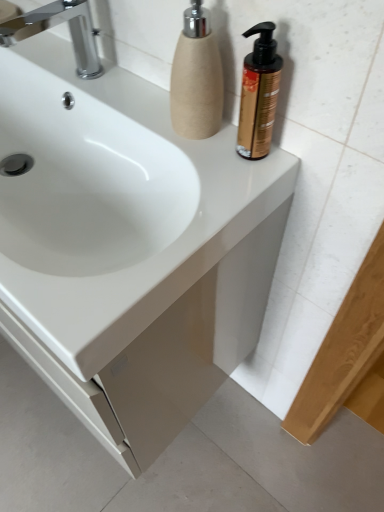
Question: From a real-world perspective, is chrome metallic faucet at upper left on top of beige textured soap dispenser at upper right, marked as the 2th soap dispenser in a right-to-left arrangement?

Choices:
 (A) no
 (B) yes

Answer: (A)

Question: From the image's perspective, is chrome metallic faucet at upper left above beige textured soap dispenser at upper right, which is the first soap dispenser in left-to-right order?

Choices:
 (A) yes
 (B) no

Answer: (A)

Question: Is there a large distance between chrome metallic faucet at upper left and beige textured soap dispenser at upper right, marked as the 2th soap dispenser in a right-to-left arrangement?

Choices:
 (A) no
 (B) yes

Answer: (A)

Question: Does chrome metallic faucet at upper left appear on the right side of beige textured soap dispenser at upper right, marked as the 2th soap dispenser in a right-to-left arrangement?

Choices:
 (A) no
 (B) yes

Answer: (A)

Question: Considering the relative sizes of chrome metallic faucet at upper left and beige textured soap dispenser at upper right, which is the first soap dispenser in left-to-right order, in the image provided, is chrome metallic faucet at upper left wider than beige textured soap dispenser at upper right, which is the first soap dispenser in left-to-right order,?

Choices:
 (A) yes
 (B) no

Answer: (A)

Question: From the image's perspective, relative to white glossy sink at center, is chrome metallic faucet at upper left above or below?

Choices:
 (A) above
 (B) below

Answer: (A)

Question: In the image, is chrome metallic faucet at upper left positioned in front of or behind white glossy sink at center?

Choices:
 (A) behind
 (B) front

Answer: (A)

Question: Is chrome metallic faucet at upper left inside the boundaries of white glossy sink at center, or outside?

Choices:
 (A) inside
 (B) outside

Answer: (B)

Question: Considering the positions of point (84, 45) and point (155, 230), is point (84, 45) closer or farther from the camera than point (155, 230)?

Choices:
 (A) closer
 (B) farther

Answer: (B)

Question: Do you think white glossy sink at center is within beige textured soap dispenser at upper right, which is the first soap dispenser in left-to-right order, or outside of it?

Choices:
 (A) inside
 (B) outside

Answer: (B)

Question: From a real-world perspective, is white glossy sink at center above or below beige textured soap dispenser at upper right, marked as the 2th soap dispenser in a right-to-left arrangement?

Choices:
 (A) below
 (B) above

Answer: (A)

Question: Based on their sizes in the image, would you say white glossy sink at center is bigger or smaller than beige textured soap dispenser at upper right, marked as the 2th soap dispenser in a right-to-left arrangement?

Choices:
 (A) big
 (B) small

Answer: (A)

Question: Is white glossy sink at center in front of or behind beige textured soap dispenser at upper right, marked as the 2th soap dispenser in a right-to-left arrangement, in the image?

Choices:
 (A) behind
 (B) front

Answer: (B)

Question: Is point (233, 223) positioned closer to the camera than point (274, 111)?

Choices:
 (A) closer
 (B) farther

Answer: (A)

Question: From the image's perspective, is white glossy sink at center located above or below gold metallic pump bottle at upper right, the 2th soap dispenser from the left?

Choices:
 (A) below
 (B) above

Answer: (A)